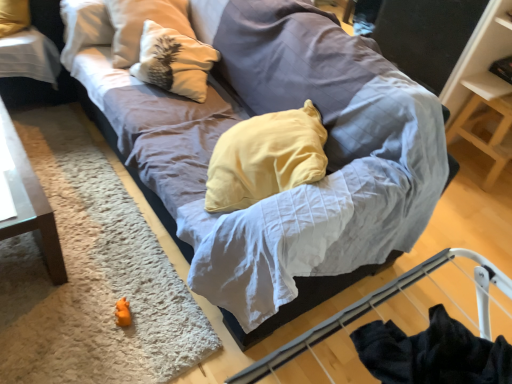
This screenshot has width=512, height=384. Find the location of `free space that is to the left of orange plush toy at lower left`. free space that is to the left of orange plush toy at lower left is located at coordinates (81, 304).